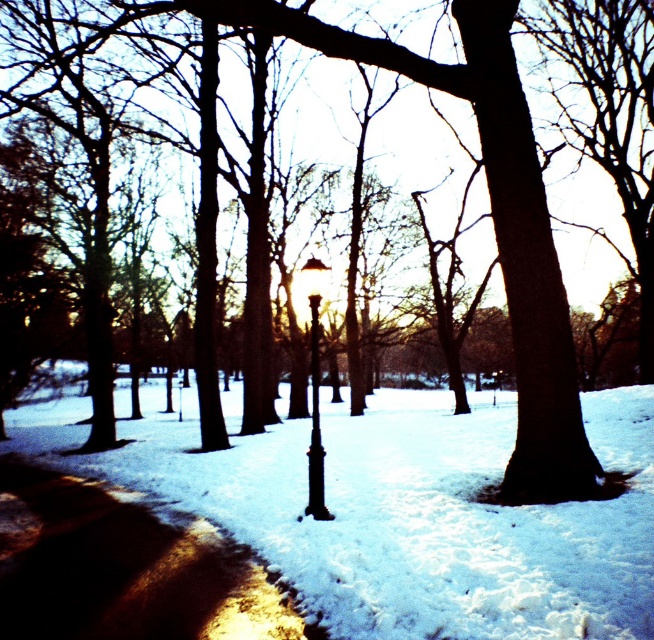
Does white fluffy snow at center have a greater height compared to shiny brass lamp post at center?

Correct, white fluffy snow at center is much taller as shiny brass lamp post at center.

Which is in front, point (445, 406) or point (311, 442)?

Point (311, 442) is in front.

Identify the location of white fluffy snow at center. The width and height of the screenshot is (654, 640). (402, 509).

Is shiny asphalt pavement at lower left above shiny brass lamp post at center?

No, shiny asphalt pavement at lower left is not above shiny brass lamp post at center.

Is shiny asphalt pavement at lower left smaller than shiny brass lamp post at center?

Indeed, shiny asphalt pavement at lower left has a smaller size compared to shiny brass lamp post at center.

Image resolution: width=654 pixels, height=640 pixels. Identify the location of shiny asphalt pavement at lower left. (122, 566).

Does white fluffy snow at center have a greater height compared to shiny asphalt pavement at lower left?

Correct, white fluffy snow at center is much taller as shiny asphalt pavement at lower left.

Is white fluffy snow at center below shiny asphalt pavement at lower left?

Indeed, white fluffy snow at center is positioned under shiny asphalt pavement at lower left.

Is point (383, 500) in front of point (162, 556)?

No, it is behind (162, 556).

Identify the location of white fluffy snow at center. (402, 509).